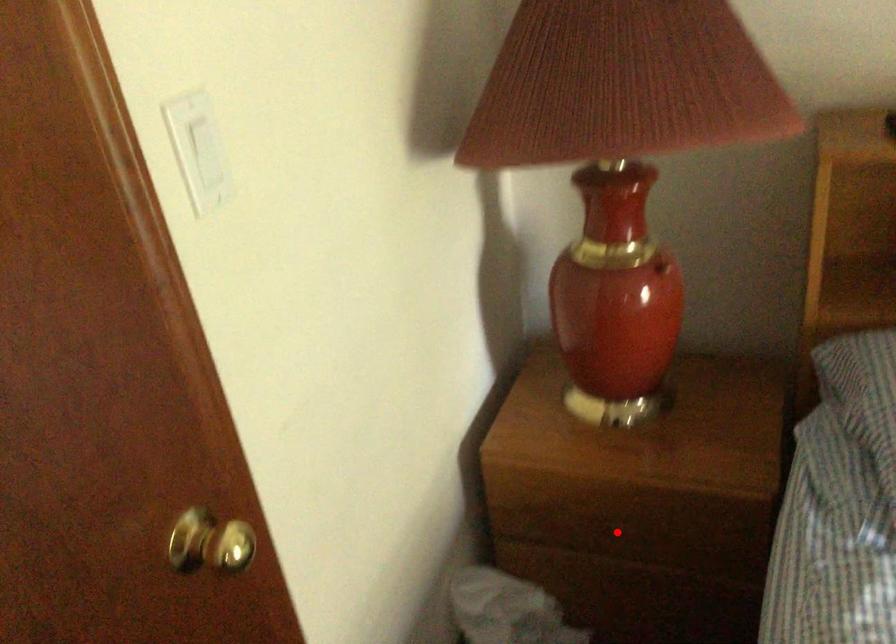
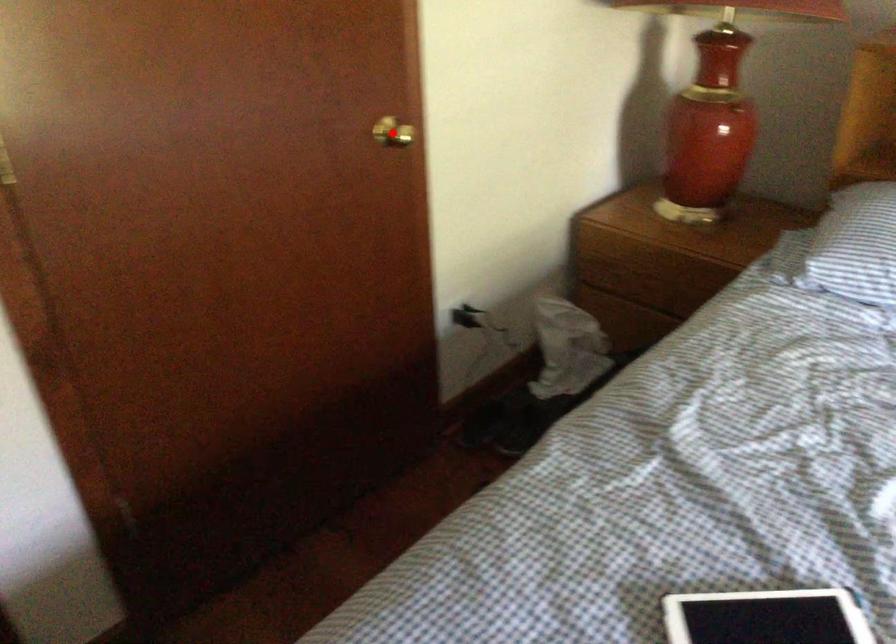
I am providing you with two images of the same scene from different viewpoints. A red point is marked on the first image and another point is marked on the second image. Does the point marked in image1 correspond to the same location as the one in image2?

No